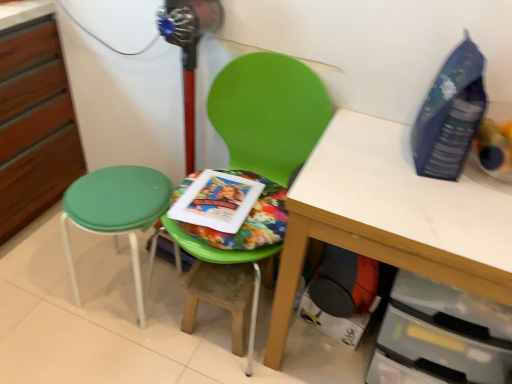
I want to click on blank space above multicolored fabric paperback book at center (from a real-world perspective), so click(219, 203).